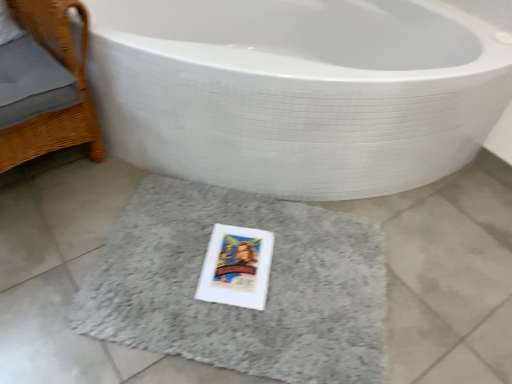
At what (x,y) coordinates should I click in order to perform the action: click on empty space that is ontop of gray shaggy bath mat at center (from a real-world perspective). Please return your answer as a coordinate pair (x, y). This screenshot has width=512, height=384. Looking at the image, I should click on (236, 266).